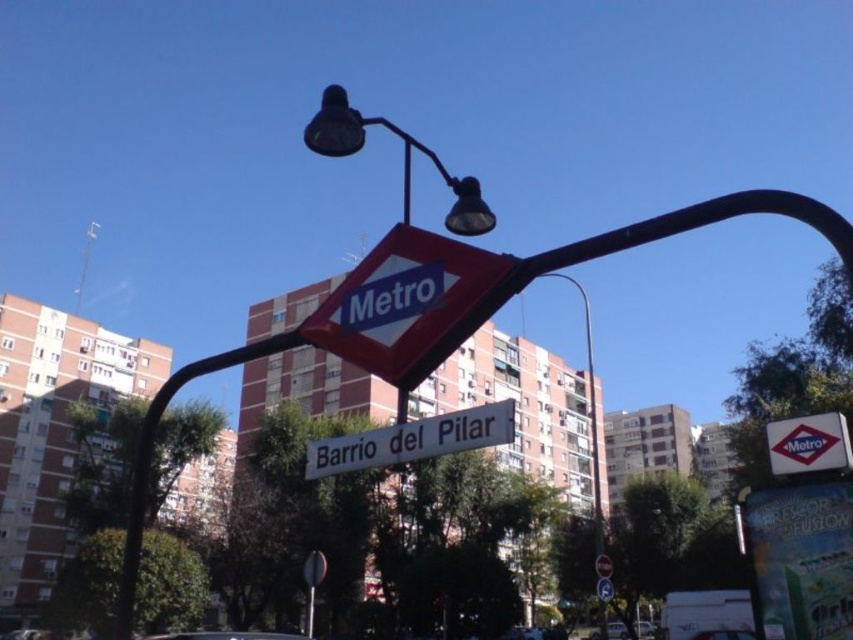
Question: Is blue plastic metro sign at upper center positioned behind metallic streetlight at upper center?

Choices:
 (A) no
 (B) yes

Answer: (A)

Question: Which point is farther to the camera?

Choices:
 (A) (473, 182)
 (B) (177, 637)
 (C) (608, 637)

Answer: (C)

Question: Among these objects, which one is nearest to the camera?

Choices:
 (A) metallic streetlight at upper center
 (B) white glossy car at center
 (C) metallic streetlight at center
 (D) white plastic street sign at center

Answer: (D)

Question: Estimate the real-world distances between objects in this image. Which object is farther from the white plastic street sign at center?

Choices:
 (A) white plastic traffic sign at upper center
 (B) metallic streetlight at upper center
 (C) white glossy car at center
 (D) blue plastic metro sign at upper center

Answer: (B)

Question: Is metallic silver car at center behind white glossy car at center?

Choices:
 (A) no
 (B) yes

Answer: (A)

Question: Does metallic silver car at center come behind white plastic traffic sign at upper center?

Choices:
 (A) yes
 (B) no

Answer: (B)